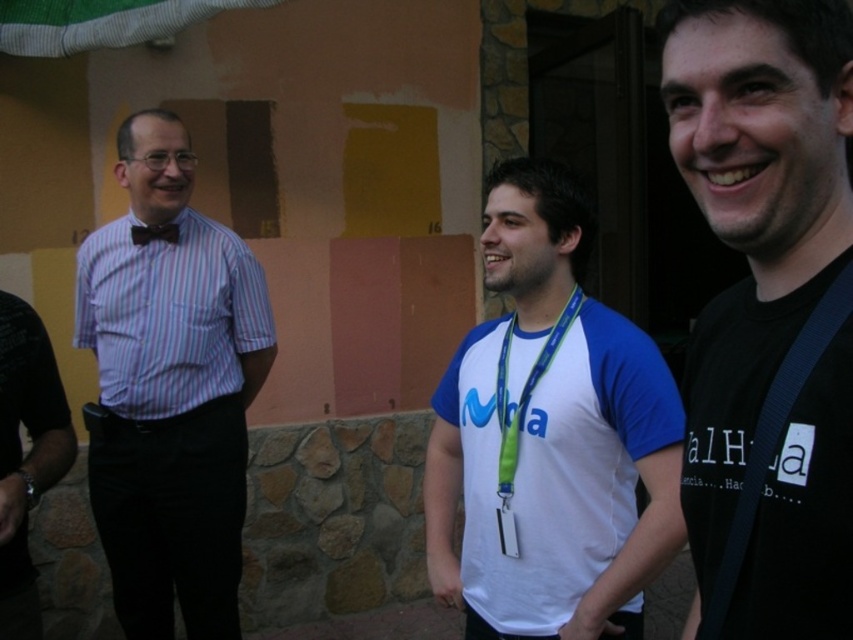
You are organizing a clothing donation drive and need to categorize the striped cotton shirt at left and the white fabric at center based on their sizes. Which one should be placed in the large size bin?

The striped cotton shirt at left should be placed in the large size bin because it has a larger size compared to the white fabric at center.

You are trying to decide which clothing item to choose for an event where you want to look taller. Based on the image, which between the striped cotton shirt at left and the white fabric at center would you recommend?

The striped cotton shirt at left has a greater height compared to the white fabric at center, so it would be a better choice to appear taller.